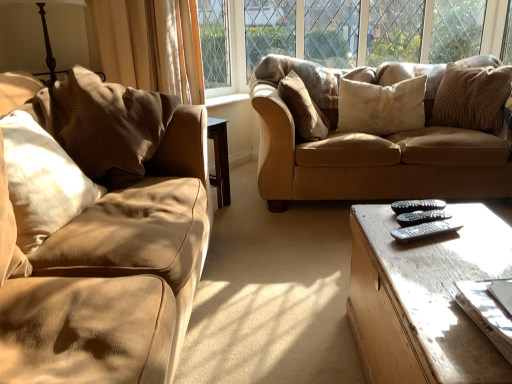
Where is `vacant area that lies to the right of black plastic remote at center, which is the first remote in front-to-back order`? The image size is (512, 384). vacant area that lies to the right of black plastic remote at center, which is the first remote in front-to-back order is located at coordinates (477, 227).